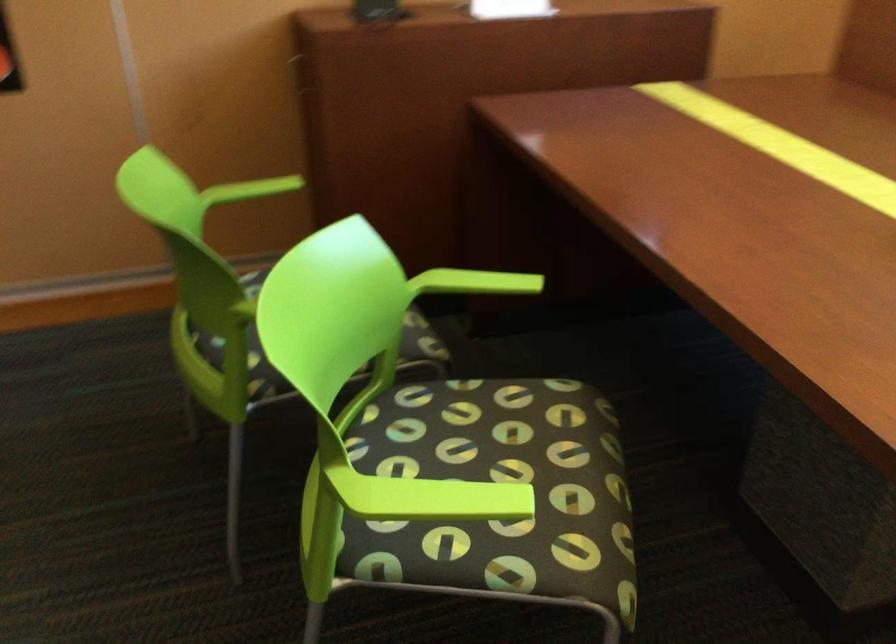
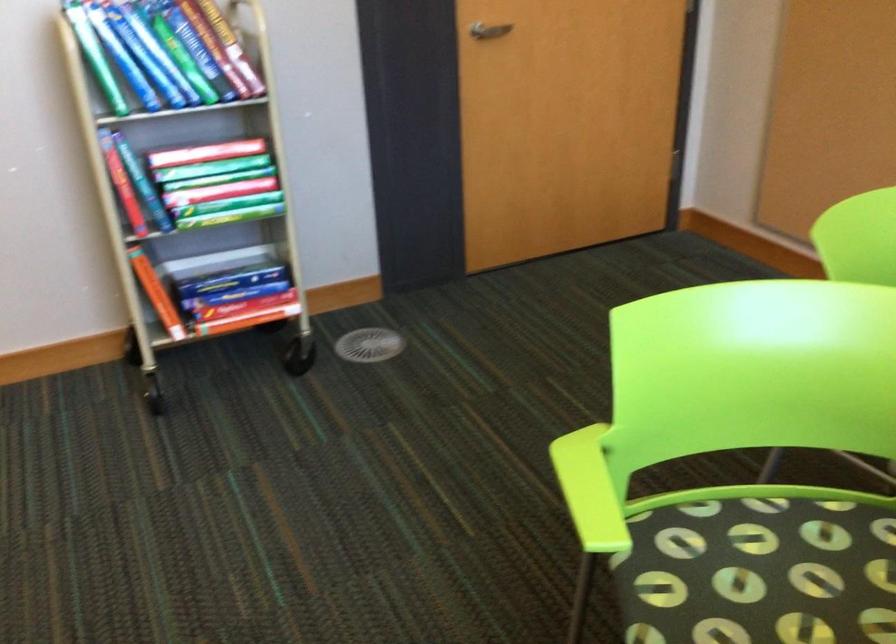
The first image is from the beginning of the video and the second image is from the end. How did the camera likely rotate when shooting the video?

The camera rotated toward left-down.